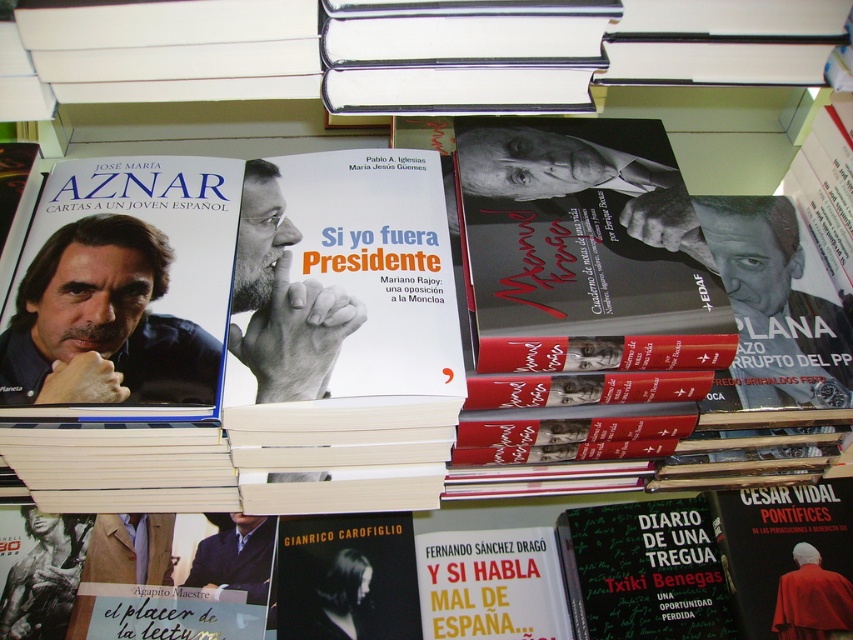
Looking at this image, is matte black book cover at left bigger than matte black book cover at center?

No, matte black book cover at left is not bigger than matte black book cover at center.

Does matte black book cover at left have a greater height compared to matte black book cover at center?

In fact, matte black book cover at left may be shorter than matte black book cover at center.

What do you see at coordinates (102, 323) in the screenshot? The image size is (853, 640). I see `matte black book cover at left` at bounding box center [102, 323].

This screenshot has width=853, height=640. Find the location of `matte black book cover at left`. matte black book cover at left is located at coordinates (102, 323).

Does matte black book at center have a lesser height compared to matte black book cover at center?

In fact, matte black book at center may be taller than matte black book cover at center.

Where is `matte black book at center`? The height and width of the screenshot is (640, 853). matte black book at center is located at coordinates (234, 336).

Between point (62, 468) and point (822, 326), which one is positioned behind?

Point (822, 326)

Identify the location of matte black book at center. (234, 336).

Is matte black book at center thinner than matte black book cover at left?

No.

Is point (364, 182) positioned after point (13, 339)?

Yes, it is behind point (13, 339).

Locate an element on the screen. This screenshot has width=853, height=640. matte black book at center is located at coordinates tap(234, 336).

The image size is (853, 640). I want to click on matte black book at center, so click(234, 336).